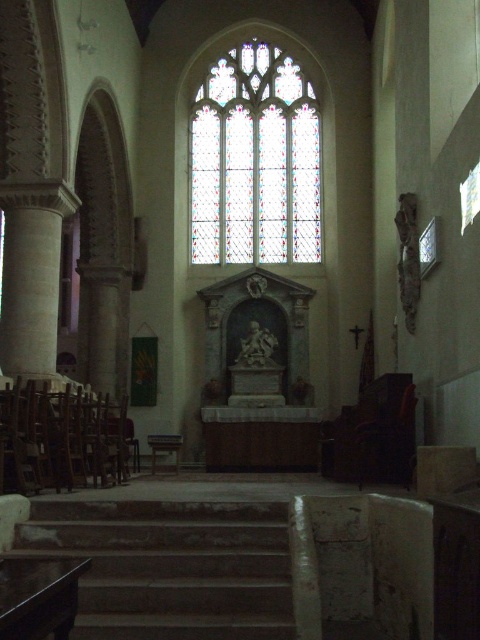
Question: Considering the relative positions of stone stairs at center and stained glass window at center in the image provided, where is stone stairs at center located with respect to stained glass window at center?

Choices:
 (A) right
 (B) left

Answer: (B)

Question: Estimate the real-world distances between objects in this image. Which object is farther from the stained glass window at center?

Choices:
 (A) stone stairs at center
 (B) wooden at left

Answer: (A)

Question: Among these objects, which one is nearest to the camera?

Choices:
 (A) white stone column at left
 (B) stone stairs at center

Answer: (B)

Question: Does stone stairs at center appear under stained glass window at center?

Choices:
 (A) no
 (B) yes

Answer: (B)

Question: Can you confirm if stained glass window at center is positioned to the right of white stone column at left?

Choices:
 (A) no
 (B) yes

Answer: (B)

Question: Estimate the real-world distances between objects in this image. Which object is closer to the white stone column at left?

Choices:
 (A) wooden at left
 (B) stained glass window at center

Answer: (A)